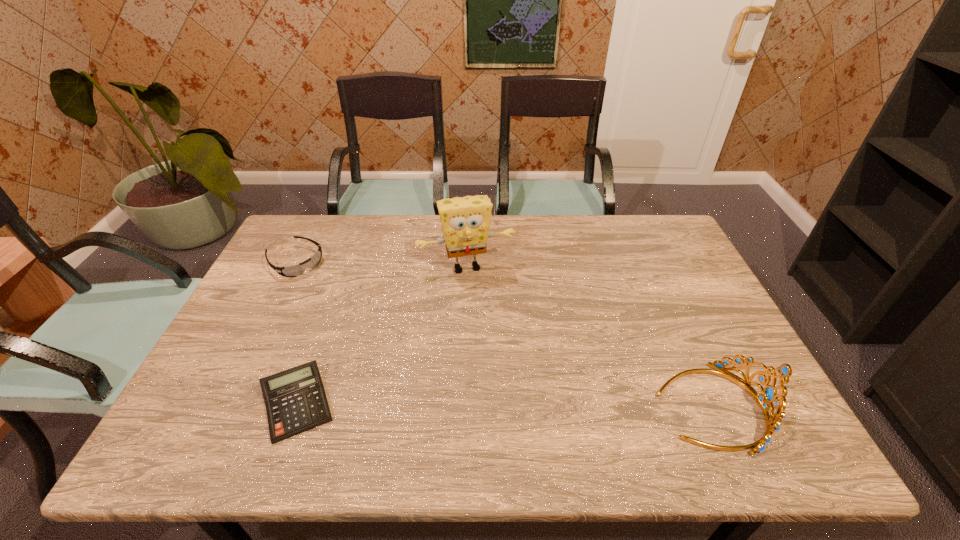
In order to click on vacant space that satisfies the following two spatial constraints: 1. on the front side of the sponge; 2. on the front-facing side of the rightmost object in this screenshot , I will do `click(461, 406)`.

You are a GUI agent. You are given a task and a screenshot of the screen. Output one action in this format:
    pyautogui.click(x=<x>, y=<y>)
    Task: Click on the vacant position in the image that satisfies the following two spatial constraints: 1. on the back side of the calculator; 2. on the left side of the second object from right to left
    Image resolution: width=960 pixels, height=540 pixels.
    Given the screenshot: What is the action you would take?
    pyautogui.click(x=347, y=267)

Where is `free space that satisfies the following two spatial constraints: 1. on the front side of the rightmost object; 2. on the front-facing side of the calculator`? The height and width of the screenshot is (540, 960). free space that satisfies the following two spatial constraints: 1. on the front side of the rightmost object; 2. on the front-facing side of the calculator is located at coordinates (297, 406).